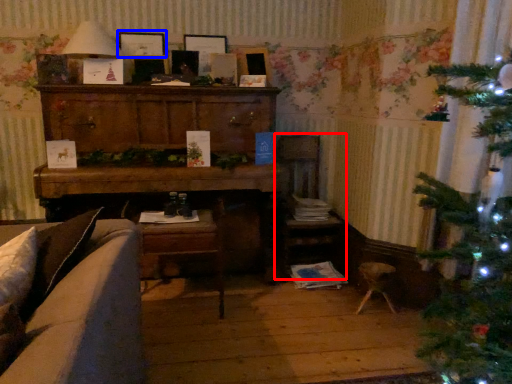
Question: Which point is closer to the camera, armchair (highlighted by a red box) or picture frame (highlighted by a blue box)?

Choices:
 (A) armchair
 (B) picture frame

Answer: (A)